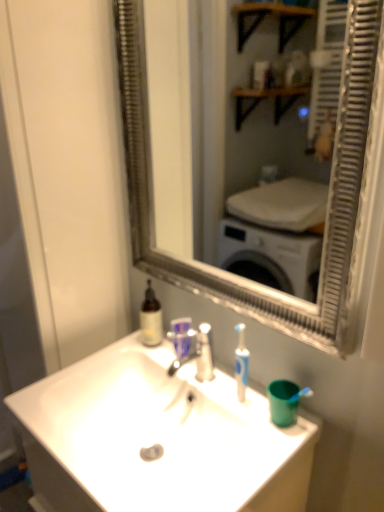
Question: In the image, is silver metallic mirror at center on the left side or the right side of translucent glass bottle at upper left?

Choices:
 (A) right
 (B) left

Answer: (A)

Question: From a real-world perspective, is silver metallic mirror at center positioned above or below translucent glass bottle at upper left?

Choices:
 (A) above
 (B) below

Answer: (A)

Question: Estimate the real-world distances between objects in this image. Which object is farther from the translucent plastic mouthwash at center?

Choices:
 (A) translucent glass bottle at upper left
 (B) white glossy glass door at left
 (C) white glossy sink at center
 (D) silver metallic faucet at center
 (E) silver metallic mirror at center

Answer: (E)

Question: Which is farther from the white glossy sink at center?

Choices:
 (A) silver metallic mirror at center
 (B) translucent glass bottle at upper left
 (C) white glossy glass door at left
 (D) silver metallic faucet at center
 (E) translucent plastic mouthwash at center

Answer: (A)